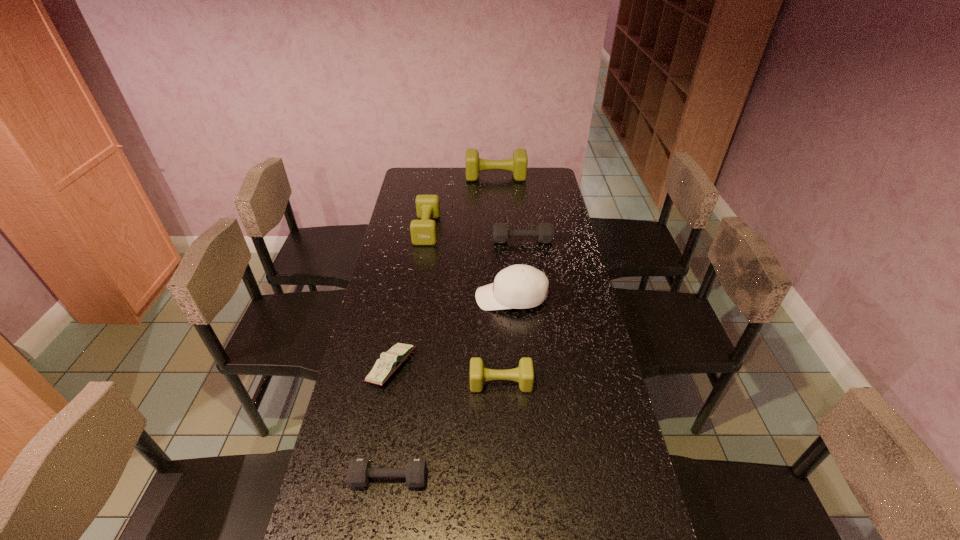
I want to click on the farthest object, so click(518, 164).

The width and height of the screenshot is (960, 540). What are the coordinates of `the farthest dumbbell` in the screenshot? It's located at (518, 164).

You are a GUI agent. You are given a task and a screenshot of the screen. Output one action in this format:
    pyautogui.click(x=<x>, y=<y>)
    Task: Click on the white baseball cap
    The image size is (960, 540).
    Given the screenshot: What is the action you would take?
    point(519,286)

Where is `the fourth farthest object`? Image resolution: width=960 pixels, height=540 pixels. the fourth farthest object is located at coordinates (519, 286).

I want to click on the second nearest olive dumbbell, so click(x=423, y=232).

Locate an element on the screen. the second biggest olive dumbbell is located at coordinates (423, 232).

The width and height of the screenshot is (960, 540). What are the coordinates of `the right gray dumbbell` in the screenshot? It's located at (545, 233).

Locate an element on the screen. This screenshot has width=960, height=540. the farther gray dumbbell is located at coordinates (545, 233).

Identify the location of the second nearest dumbbell. The width and height of the screenshot is (960, 540). 524,374.

Where is `the nearest olive dumbbell`? the nearest olive dumbbell is located at coordinates (524, 374).